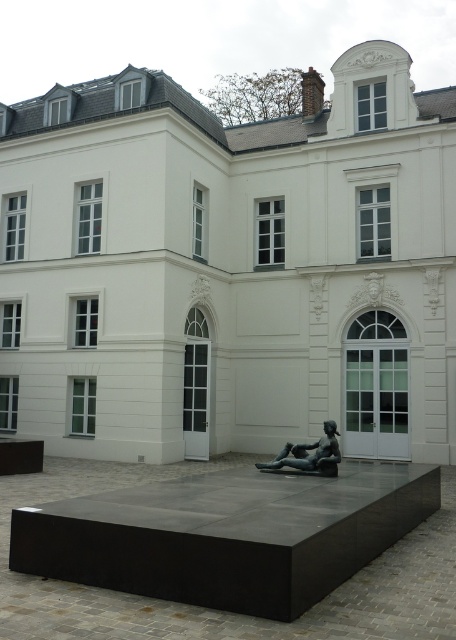
Question: Among these objects, which one is nearest to the camera?

Choices:
 (A) bronze statue at center
 (B) white smooth building at center

Answer: (A)

Question: Is white smooth building at center bigger than bronze statue at center?

Choices:
 (A) no
 (B) yes

Answer: (B)

Question: Which of the following is the farthest from the observer?

Choices:
 (A) white smooth building at center
 (B) bronze statue at center

Answer: (A)

Question: Considering the relative positions of white smooth building at center and bronze statue at center in the image provided, where is white smooth building at center located with respect to bronze statue at center?

Choices:
 (A) left
 (B) right

Answer: (A)

Question: Which point is closer to the camera taking this photo?

Choices:
 (A) (300, 371)
 (B) (316, 458)

Answer: (B)

Question: Is white smooth building at center further to camera compared to bronze statue at center?

Choices:
 (A) yes
 (B) no

Answer: (A)